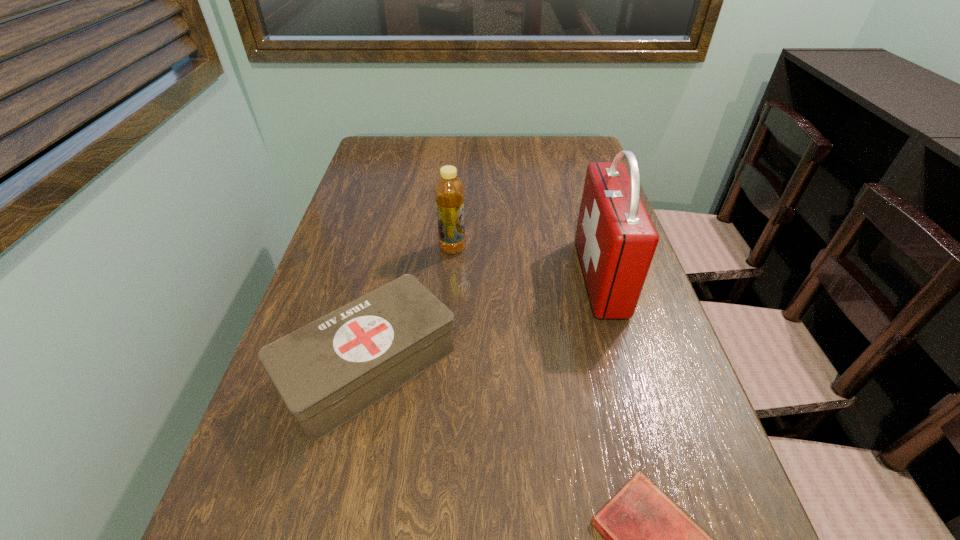
Identify the location of object that is at the left edge. (328, 371).

Find the location of `object that is positioned at the right edge`. object that is positioned at the right edge is located at coordinates (616, 240).

Image resolution: width=960 pixels, height=540 pixels. Find the location of `free region at the far edge`. free region at the far edge is located at coordinates (484, 152).

In the image, there is a desktop. Find the location of `free space at the left edge`. free space at the left edge is located at coordinates (271, 441).

In order to click on vacant space at the right edge of the desktop in this screenshot , I will do `click(564, 184)`.

Where is `vacant space at the far left corner`? vacant space at the far left corner is located at coordinates (362, 158).

You are a GUI agent. You are given a task and a screenshot of the screen. Output one action in this format:
    pyautogui.click(x=<x>, y=<y>)
    Task: Click on the free spot between the tallest object and the third shortest object
    The height and width of the screenshot is (540, 960).
    Given the screenshot: What is the action you would take?
    pyautogui.click(x=526, y=263)

The width and height of the screenshot is (960, 540). I want to click on free area in between the tallest object and the bottle, so click(x=526, y=263).

Select which object is the closest to the tallest object. Please provide its 2D coordinates. Your answer should be formatted as a tuple, i.e. [(x, y)], where the tuple contains the x and y coordinates of a point satisfying the conditions above.

[(449, 192)]

Locate which object is the third closest to the nearest object. Please provide its 2D coordinates. Your answer should be formatted as a tuple, i.e. [(x, y)], where the tuple contains the x and y coordinates of a point satisfying the conditions above.

[(449, 192)]